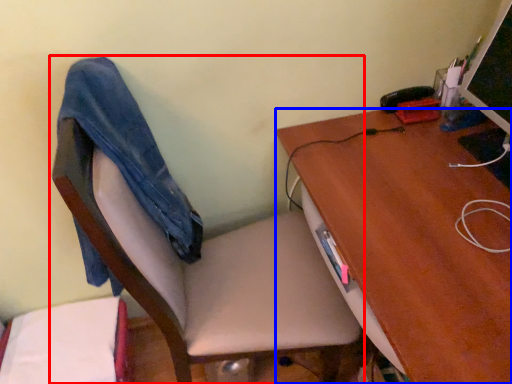
Question: Among these objects, which one is nearest to the camera, chair (highlighted by a red box) or desk (highlighted by a blue box)?

Choices:
 (A) chair
 (B) desk

Answer: (A)